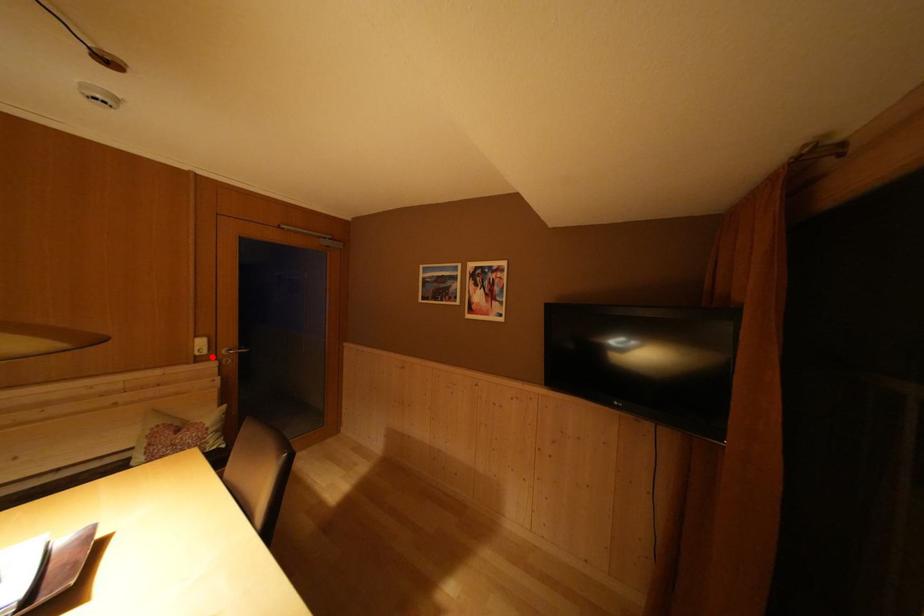
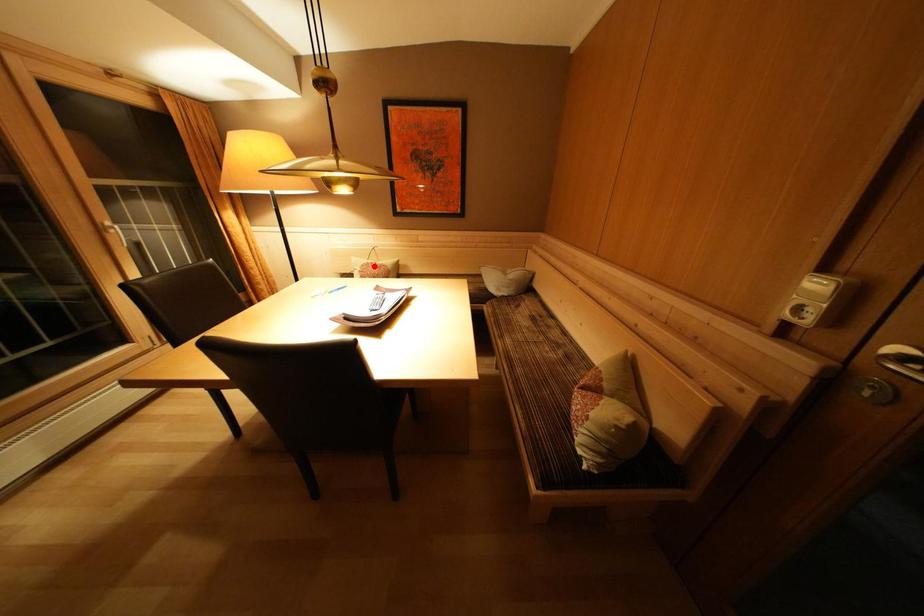
I am providing you with two images of the same scene from different viewpoints. A red point is marked on the first image and another point is marked on the second image. Do the highlighted points in image1 and image2 indicate the same real-world spot?

No